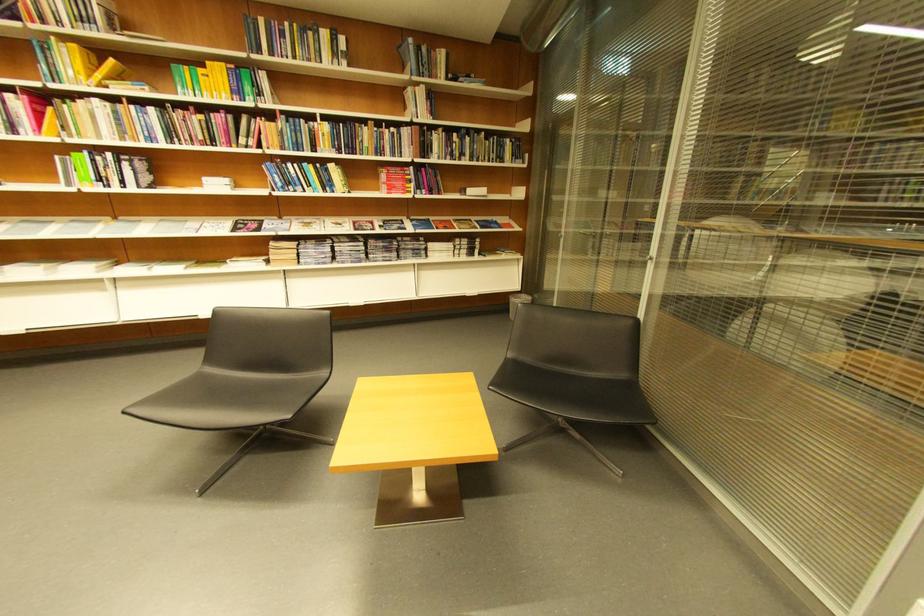
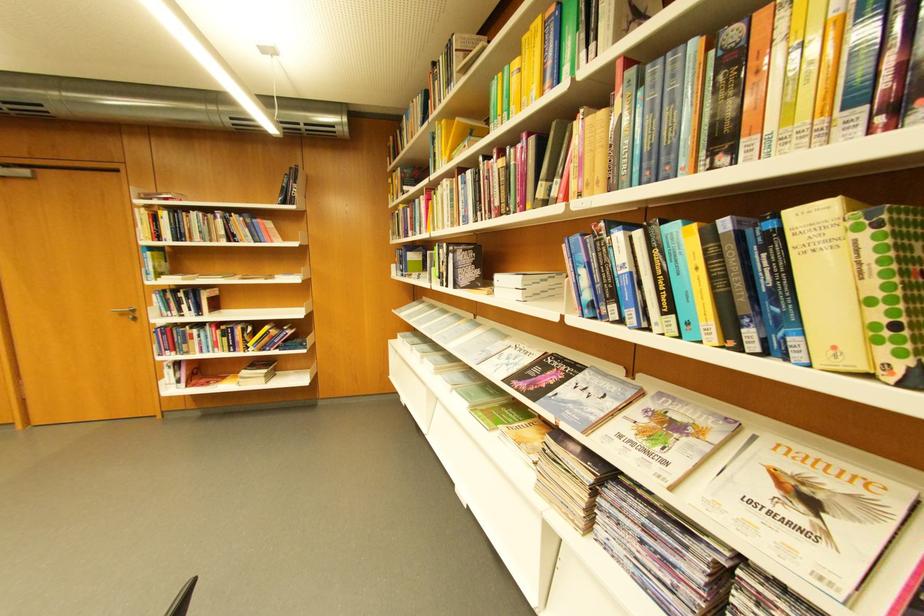
Where in the second image is the point corresponding to [246,231] from the first image?

(532, 377)